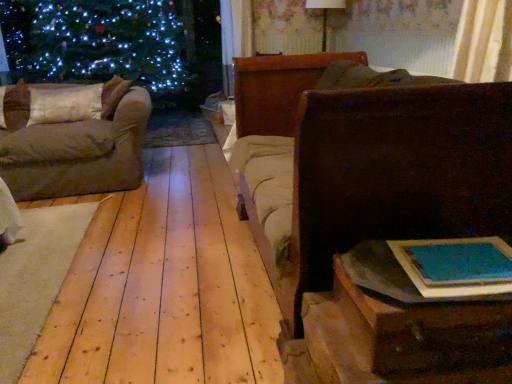
Measure the distance between white fabric pillow at left and camera.

3.12 meters.

Where is `white fabric pillow at left`? The width and height of the screenshot is (512, 384). white fabric pillow at left is located at coordinates (64, 103).

The image size is (512, 384). I want to click on matte white lampshade at upper center, so click(x=325, y=14).

At what (x,y) coordinates should I click in order to perform the action: click on blue paper book at lower right. Please return your answer as a coordinate pair (x, y). Image resolution: width=512 pixels, height=384 pixels. Looking at the image, I should click on (456, 266).

Measure the distance between brown fabric couch at left and camera.

They are 2.87 meters apart.

Identify the location of white fabric pillow at left. (64, 103).

From a real-world perspective, which object stands above the other?

matte white lampshade at upper center is physically above.

Between blue paper book at lower right and matte white lampshade at upper center, which one appears on the left side from the viewer's perspective?

blue paper book at lower right.

Considering the relative sizes of blue paper book at lower right and matte white lampshade at upper center in the image provided, is blue paper book at lower right taller than matte white lampshade at upper center?

In fact, blue paper book at lower right may be shorter than matte white lampshade at upper center.

Does point (432, 283) lie in front of point (312, 2)?

Yes, point (432, 283) is closer to viewer.

Which of these two, dark brown wood chest at right or brown fabric couch at left, is bigger?

Bigger between the two is dark brown wood chest at right.

You are a GUI agent. You are given a task and a screenshot of the screen. Output one action in this format:
    pyautogui.click(x=<x>, y=<y>)
    Task: Click on the furniture below the brown fabric couch at left (from the image's perspective)
    The height and width of the screenshot is (384, 512).
    Given the screenshot: What is the action you would take?
    pyautogui.click(x=362, y=163)

Between point (344, 236) and point (83, 186), which one is positioned behind?

The point (83, 186) is more distant.

From the image's perspective, is dark brown wood chest at right located above brown fabric couch at left?

Actually, dark brown wood chest at right appears below brown fabric couch at left in the image.

Is the position of wooden table at lower right less distant than that of white fabric pillow at left?

Yes, it is in front of white fabric pillow at left.

Which is nearer, (368, 302) or (62, 113)?

Point (368, 302) is positioned closer to the camera compared to point (62, 113).

Considering the sizes of wooden table at lower right and white fabric pillow at left in the image, is wooden table at lower right bigger or smaller than white fabric pillow at left?

Considering their sizes, wooden table at lower right takes up less space than white fabric pillow at left.

Who is taller, wooden table at lower right or white fabric pillow at left?

Standing taller between the two is white fabric pillow at left.

What's the angular difference between matte white lampshade at upper center and blue paper book at lower right's facing directions?

48.7 degrees separate the facing orientations of matte white lampshade at upper center and blue paper book at lower right.

Is matte white lampshade at upper center to the right of blue paper book at lower right from the viewer's perspective?

Yes.

I want to click on lamp on the right of blue paper book at lower right, so click(x=325, y=14).

Which is in front, point (326, 26) or point (449, 254)?

Positioned in front is point (449, 254).

Is matte white lampshade at upper center bigger than wooden table at lower right?

Yes.

Locate an element on the screen. lamp on the right side of wooden table at lower right is located at coordinates (325, 14).

Does matte white lampshade at upper center lie behind wooden table at lower right?

Yes, matte white lampshade at upper center is further from the viewer.

From the image's perspective, would you say matte white lampshade at upper center is shown under wooden table at lower right?

No, from the image's perspective, matte white lampshade at upper center is not beneath wooden table at lower right.

From a real-world perspective, is brown fabric couch at left located beneath matte white lampshade at upper center?

Yes, from a real-world perspective, brown fabric couch at left is beneath matte white lampshade at upper center.

How distant is brown fabric couch at left from matte white lampshade at upper center?

brown fabric couch at left is 2.91 meters away from matte white lampshade at upper center.

In the scene shown: Is brown fabric couch at left not within matte white lampshade at upper center?

Absolutely, brown fabric couch at left is external to matte white lampshade at upper center.

Does point (66, 96) come farther from viewer compared to point (335, 2)?

That is False.

Between blue paper book at lower right and wooden table at lower right, which one appears on the left side from the viewer's perspective?

From the viewer's perspective, wooden table at lower right appears more on the left side.

How far apart are blue paper book at lower right and wooden table at lower right?

blue paper book at lower right and wooden table at lower right are 8.58 centimeters apart.

Is point (497, 248) closer to camera compared to point (408, 350)?

No, (497, 248) is further to viewer.

Considering their positions, is blue paper book at lower right located in front of or behind wooden table at lower right?

Visually, blue paper book at lower right is located behind wooden table at lower right.

Where is `lamp on the right of blue paper book at lower right`? This screenshot has width=512, height=384. lamp on the right of blue paper book at lower right is located at coordinates (325, 14).

This screenshot has height=384, width=512. In order to click on studio couch that appears behind the dark brown wood chest at right in this screenshot , I will do `click(72, 138)`.

In the scene shown: From the image, which object appears to be nearer to dark brown wood chest at right, white fabric pillow at left or wooden table at lower right?

The object closer to dark brown wood chest at right is wooden table at lower right.

Looking at the image, which one is located further to matte white lampshade at upper center, wooden table at lower right or dark brown wood chest at right?

wooden table at lower right is positioned further to the anchor matte white lampshade at upper center.

From the image, which object appears to be farther from wooden table at lower right, brown fabric couch at left or dark brown wood chest at right?

brown fabric couch at left is further to wooden table at lower right.

Based on their spatial positions, is dark brown wood chest at right or blue paper book at lower right closer to matte white lampshade at upper center?

dark brown wood chest at right is positioned closer to the anchor matte white lampshade at upper center.

Considering their positions, is wooden table at lower right positioned closer to matte white lampshade at upper center than white fabric pillow at left?

white fabric pillow at left.

Looking at the image, which one is located further to wooden table at lower right, brown fabric couch at left or matte white lampshade at upper center?

Based on the image, matte white lampshade at upper center appears to be further to wooden table at lower right.

Based on their spatial positions, is matte white lampshade at upper center or white fabric pillow at left closer to dark brown wood chest at right?

white fabric pillow at left is positioned closer to the anchor dark brown wood chest at right.

When comparing their distances from dark brown wood chest at right, does wooden table at lower right or matte white lampshade at upper center seem further?

The object further to dark brown wood chest at right is matte white lampshade at upper center.

Identify the location of furniture located between brown fabric couch at left and blue paper book at lower right in the left-right direction. (x=362, y=163).

At what (x,y) coordinates should I click in order to perform the action: click on studio couch between white fabric pillow at left and matte white lampshade at upper center from left to right. Please return your answer as a coordinate pair (x, y). This screenshot has width=512, height=384. Looking at the image, I should click on (72, 138).

Identify the location of furniture positioned between wooden table at lower right and white fabric pillow at left from near to far. Image resolution: width=512 pixels, height=384 pixels. (362, 163).

Find the location of a particular element. The image size is (512, 384). book that lies between dark brown wood chest at right and wooden table at lower right from top to bottom is located at coordinates (456, 266).